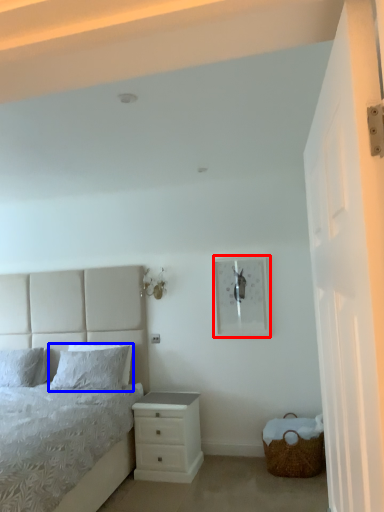
Question: Which object appears closest to the camera in this image, picture frame (highlighted by a red box) or pillow (highlighted by a blue box)?

Choices:
 (A) picture frame
 (B) pillow

Answer: (A)